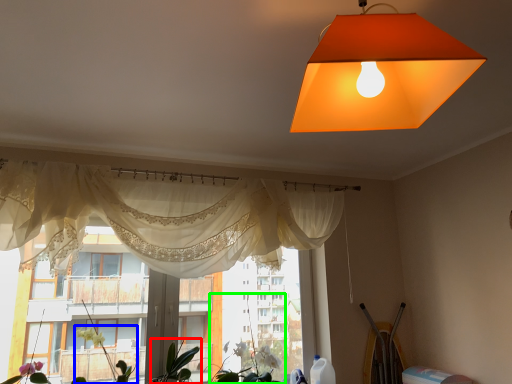
Question: Which object is positioned farthest from plant (highlighted by a red box)? Select from plant (highlighted by a blue box) and plant (highlighted by a green box).

Choices:
 (A) plant
 (B) plant

Answer: (B)